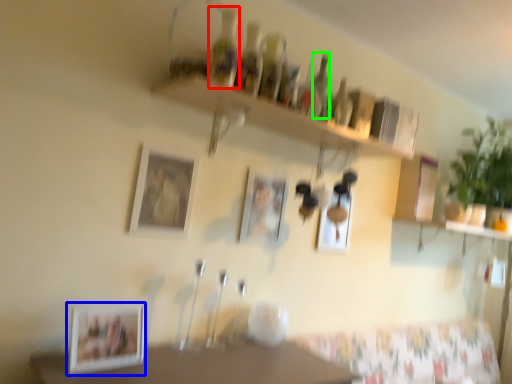
Question: Based on their relative distances, which object is farther from bottle (highlighted by a red box)? Choose from picture frame (highlighted by a blue box) and bottle (highlighted by a green box).

Choices:
 (A) picture frame
 (B) bottle

Answer: (A)